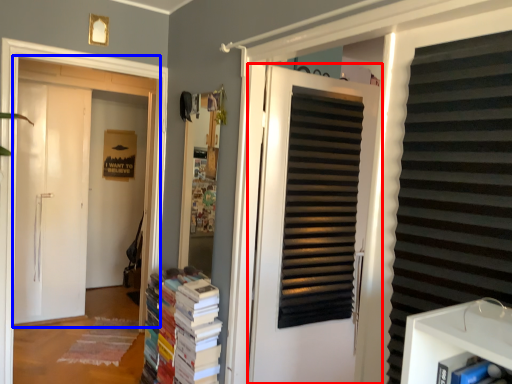
Question: Among these objects, which one is nearest to the camera, door (highlighted by a red box) or door (highlighted by a blue box)?

Choices:
 (A) door
 (B) door

Answer: (A)